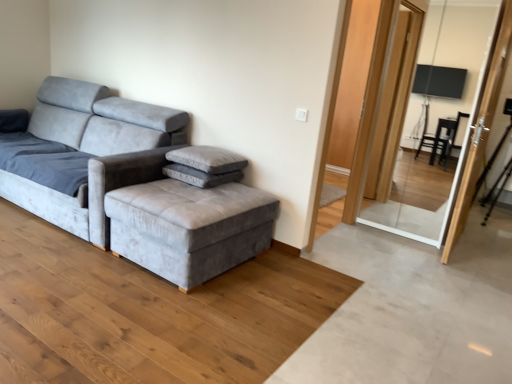
Question: Is transparent glass screen door at upper right, the second screen door from the right, to the right of gray velvety pillow at center from the viewer's perspective?

Choices:
 (A) no
 (B) yes

Answer: (B)

Question: Is transparent glass screen door at upper right, the second screen door from the right, thinner than gray velvety pillow at center?

Choices:
 (A) yes
 (B) no

Answer: (B)

Question: Considering the relative sizes of transparent glass screen door at upper right, the second screen door from the right, and gray velvety pillow at center in the image provided, is transparent glass screen door at upper right, the second screen door from the right, bigger than gray velvety pillow at center?

Choices:
 (A) no
 (B) yes

Answer: (B)

Question: Considering the relative positions of transparent glass screen door at upper right, the second screen door from the right, and gray velvety pillow at center in the image provided, is transparent glass screen door at upper right, the second screen door from the right, behind gray velvety pillow at center?

Choices:
 (A) no
 (B) yes

Answer: (B)

Question: From a real-world perspective, is transparent glass screen door at upper right, the first screen door when ordered from left to right, positioned over gray velvety pillow at center based on gravity?

Choices:
 (A) yes
 (B) no

Answer: (A)

Question: In terms of height, does transparent glass screen door at upper right, the second screen door from the right, look taller or shorter compared to velvet grey ottoman at center?

Choices:
 (A) short
 (B) tall

Answer: (B)

Question: Relative to velvet grey ottoman at center, is transparent glass screen door at upper right, the second screen door from the right, in front or behind?

Choices:
 (A) front
 (B) behind

Answer: (B)

Question: From the image's perspective, is transparent glass screen door at upper right, the second screen door from the right, positioned above or below velvet grey ottoman at center?

Choices:
 (A) above
 (B) below

Answer: (A)

Question: Is transparent glass screen door at upper right, the first screen door when ordered from left to right, wider or thinner than velvet grey ottoman at center?

Choices:
 (A) wide
 (B) thin

Answer: (B)

Question: Considering the positions of velvet grey ottoman at center and transparent glass screen door at upper right, the second screen door from the right, in the image, is velvet grey ottoman at center bigger or smaller than transparent glass screen door at upper right, the second screen door from the right,?

Choices:
 (A) small
 (B) big

Answer: (A)

Question: Is velvet grey ottoman at center to the left or to the right of transparent glass screen door at upper right, the first screen door when ordered from left to right, in the image?

Choices:
 (A) left
 (B) right

Answer: (A)

Question: Considering the positions of point (203, 236) and point (471, 6), is point (203, 236) closer or farther from the camera than point (471, 6)?

Choices:
 (A) closer
 (B) farther

Answer: (A)

Question: From a real-world perspective, is velvet grey ottoman at center positioned above or below transparent glass screen door at upper right, the first screen door when ordered from left to right?

Choices:
 (A) below
 (B) above

Answer: (A)

Question: From the image's perspective, is gray velvety pillow at center located above or below velvet grey ottoman at center?

Choices:
 (A) below
 (B) above

Answer: (B)

Question: From a real-world perspective, relative to velvet grey ottoman at center, is gray velvety pillow at center vertically above or below?

Choices:
 (A) below
 (B) above

Answer: (B)